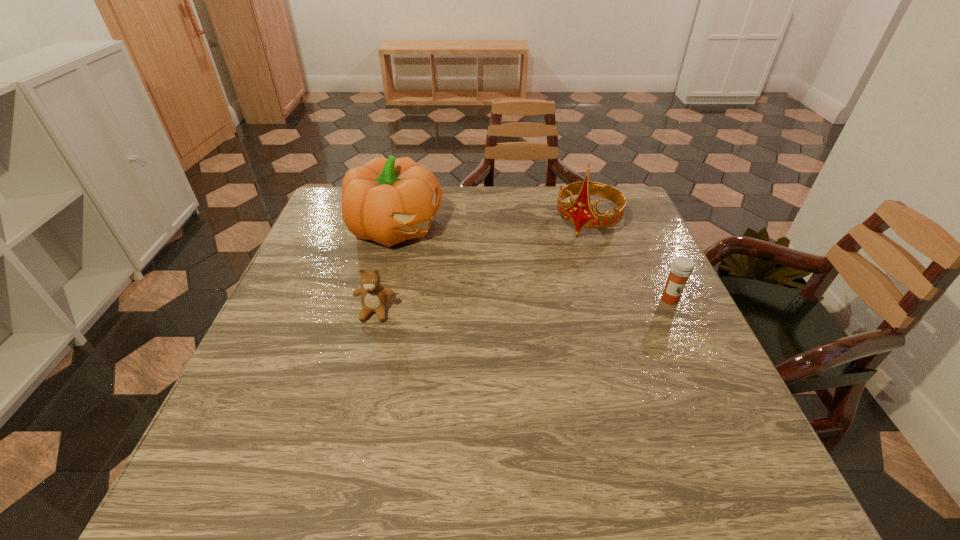
Locate an element on the screen. This screenshot has height=540, width=960. free space between the tiara and the rightmost object is located at coordinates (628, 261).

Where is `vacant area that lies between the rightmost object and the pumpkin`? vacant area that lies between the rightmost object and the pumpkin is located at coordinates (532, 264).

Identify the location of vacant area that lies between the rightmost object and the pumpkin. This screenshot has width=960, height=540. (532, 264).

Locate an element on the screen. This screenshot has width=960, height=540. free space between the pumpkin and the medicine is located at coordinates (532, 264).

Locate an element on the screen. This screenshot has width=960, height=540. object that ranks as the third closest to the medicine is located at coordinates (374, 296).

Locate an element on the screen. This screenshot has height=540, width=960. the closest object to the pumpkin is located at coordinates (374, 296).